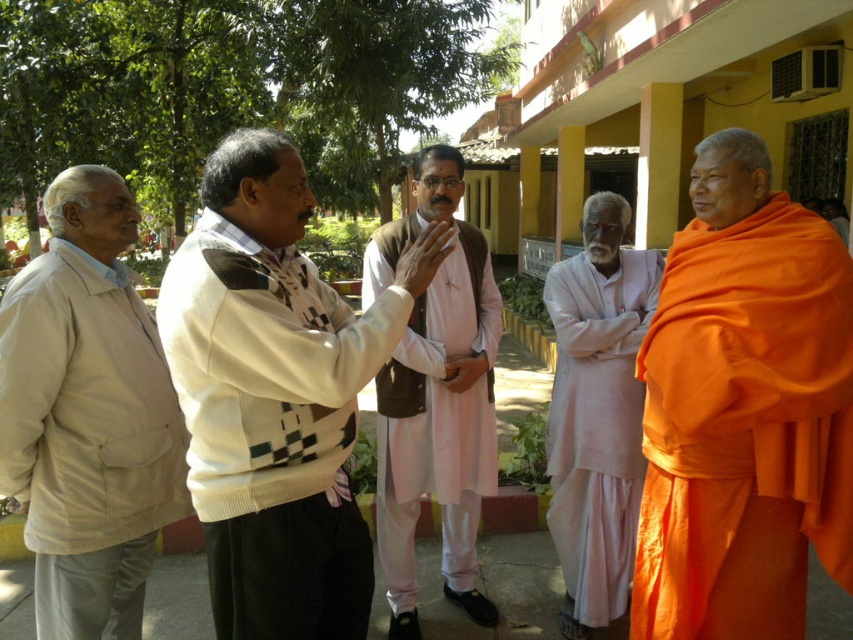
Consider the image. Is white knitted sweater at center wider than pink cotton kurta at center?

Indeed, white knitted sweater at center has a greater width compared to pink cotton kurta at center.

The width and height of the screenshot is (853, 640). What do you see at coordinates (276, 396) in the screenshot? I see `white knitted sweater at center` at bounding box center [276, 396].

Where is `white knitted sweater at center`? white knitted sweater at center is located at coordinates (276, 396).

Is orange cloth at right positioned in front of pink cotton kurta at center?

That is True.

Is orange cloth at right to the right of pink cotton kurta at center from the viewer's perspective?

Yes, orange cloth at right is to the right of pink cotton kurta at center.

Describe the element at coordinates (746, 428) in the screenshot. I see `orange cloth at right` at that location.

At what (x,y) coordinates should I click in order to perform the action: click on orange cloth at right. Please return your answer as a coordinate pair (x, y). This screenshot has width=853, height=640. Looking at the image, I should click on (746, 428).

Which of these two, orange cloth at right or light pink cotton kurta at center, stands shorter?

Standing shorter between the two is orange cloth at right.

Is point (775, 196) positioned behind point (560, 465)?

No, (775, 196) is in front of (560, 465).

Image resolution: width=853 pixels, height=640 pixels. I want to click on orange cloth at right, so click(746, 428).